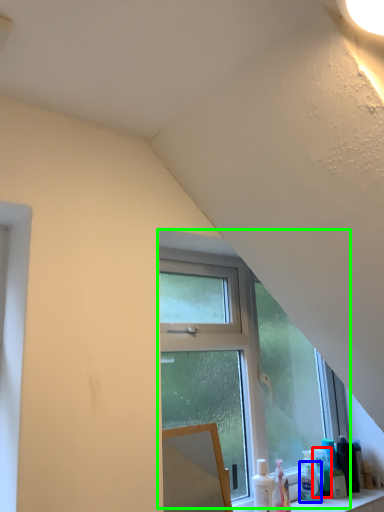
Question: Estimate the real-world distances between objects in this image. Which object is closer to toiletry (highlighted by a red box), toiletry (highlighted by a blue box) or window (highlighted by a green box)?

Choices:
 (A) toiletry
 (B) window

Answer: (A)